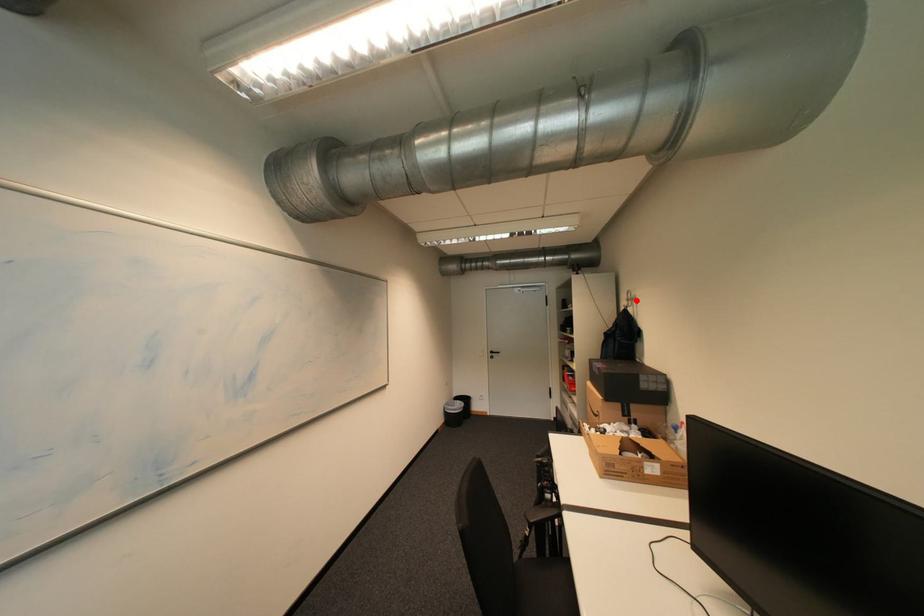
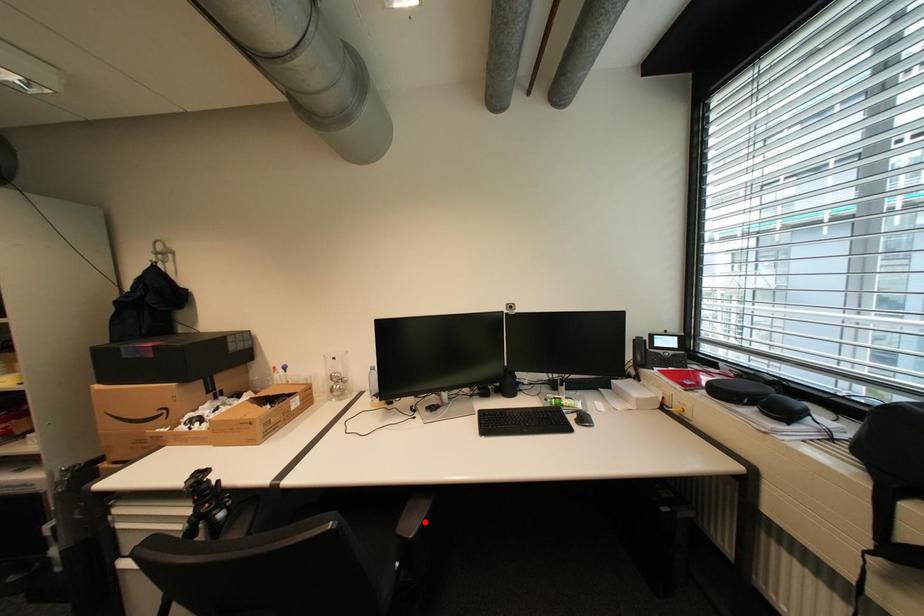
I am providing you with two images of the same scene from different viewpoints. A red point is marked on the first image and another point is marked on the second image. Is the red point in image1 aligned with the point shown in image2?

No